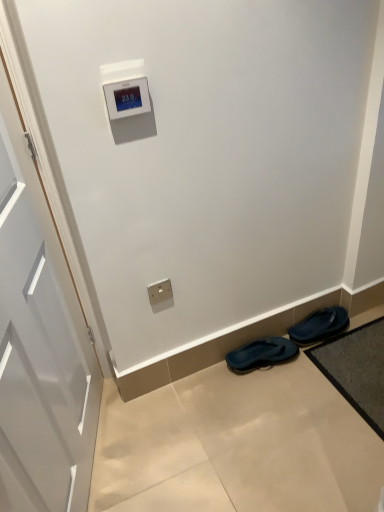
Question: From the image's perspective, would you say dark blue rubber flip-flops at lower right, the 1th footwear viewed from the left, is shown under satin gold outlet at lower center?

Choices:
 (A) yes
 (B) no

Answer: (A)

Question: Can you confirm if dark blue rubber flip-flops at lower right, the 1th footwear viewed from the left, is positioned to the right of satin gold outlet at lower center?

Choices:
 (A) no
 (B) yes

Answer: (B)

Question: Is dark blue rubber flip-flops at lower right, the second footwear from the right, positioned far away from satin gold outlet at lower center?

Choices:
 (A) no
 (B) yes

Answer: (A)

Question: Is dark blue rubber flip-flops at lower right, the 1th footwear viewed from the left, positioned with its back to satin gold outlet at lower center?

Choices:
 (A) yes
 (B) no

Answer: (B)

Question: Considering the relative sizes of dark blue rubber flip-flops at lower right, the second footwear from the right, and satin gold outlet at lower center in the image provided, is dark blue rubber flip-flops at lower right, the second footwear from the right, smaller than satin gold outlet at lower center?

Choices:
 (A) no
 (B) yes

Answer: (A)

Question: Considering the positions of point [x=158, y=286] and point [x=167, y=493], is point [x=158, y=286] closer or farther from the camera than point [x=167, y=493]?

Choices:
 (A) closer
 (B) farther

Answer: (B)

Question: In terms of width, does satin gold outlet at lower center look wider or thinner when compared to beige tile floor at lower center?

Choices:
 (A) thin
 (B) wide

Answer: (A)

Question: Is satin gold outlet at lower center taller or shorter than beige tile floor at lower center?

Choices:
 (A) tall
 (B) short

Answer: (A)

Question: Relative to beige tile floor at lower center, is satin gold outlet at lower center in front or behind?

Choices:
 (A) front
 (B) behind

Answer: (B)

Question: Considering the positions of dark blue rubber flip-flops at lower right, the second footwear from the right, and dark gray textured bath mat at lower right in the image, is dark blue rubber flip-flops at lower right, the second footwear from the right, taller or shorter than dark gray textured bath mat at lower right?

Choices:
 (A) short
 (B) tall

Answer: (B)

Question: Considering the positions of point (231, 368) and point (355, 344), is point (231, 368) closer or farther from the camera than point (355, 344)?

Choices:
 (A) closer
 (B) farther

Answer: (A)

Question: From the image's perspective, is dark blue rubber flip-flops at lower right, the second footwear from the right, above or below dark gray textured bath mat at lower right?

Choices:
 (A) below
 (B) above

Answer: (B)

Question: Looking at their shapes, would you say dark blue rubber flip-flops at lower right, the second footwear from the right, is wider or thinner than dark gray textured bath mat at lower right?

Choices:
 (A) thin
 (B) wide

Answer: (A)

Question: In terms of width, does satin gold outlet at lower center look wider or thinner when compared to dark gray textured bath mat at lower right?

Choices:
 (A) thin
 (B) wide

Answer: (A)

Question: From a real-world perspective, relative to dark gray textured bath mat at lower right, is satin gold outlet at lower center vertically above or below?

Choices:
 (A) above
 (B) below

Answer: (A)